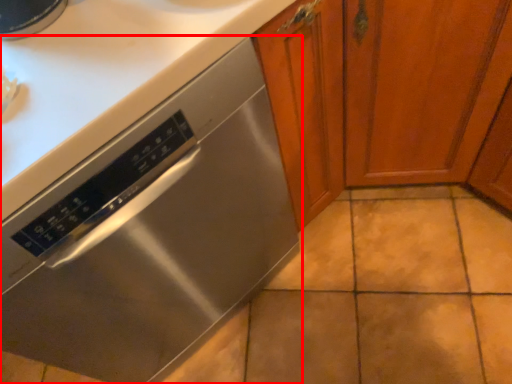
Question: Considering the relative positions of home appliance (annotated by the red box) and cabinetry in the image provided, where is home appliance (annotated by the red box) located with respect to the staircase?

Choices:
 (A) right
 (B) left

Answer: (B)